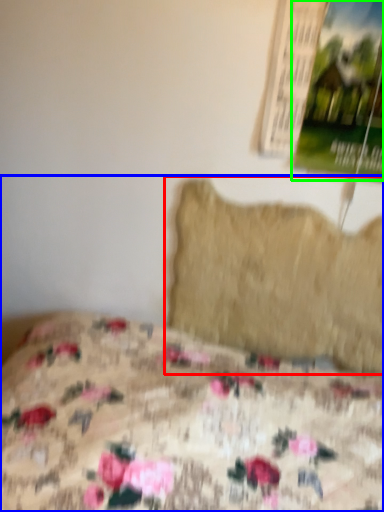
Question: Estimate the real-world distances between objects in this image. Which object is farther from pillow (highlighted by a red box), bed (highlighted by a blue box) or poster page (highlighted by a green box)?

Choices:
 (A) bed
 (B) poster page

Answer: (A)